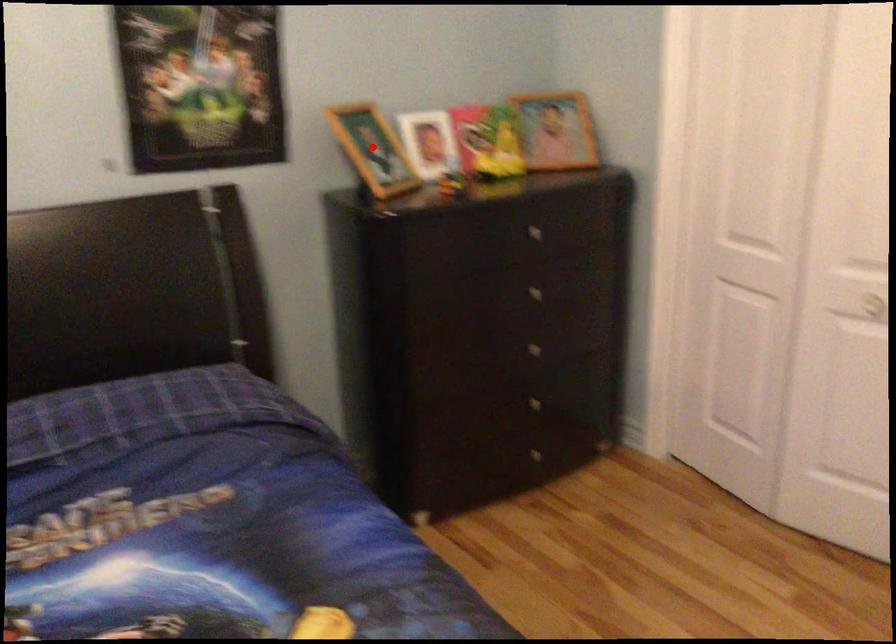
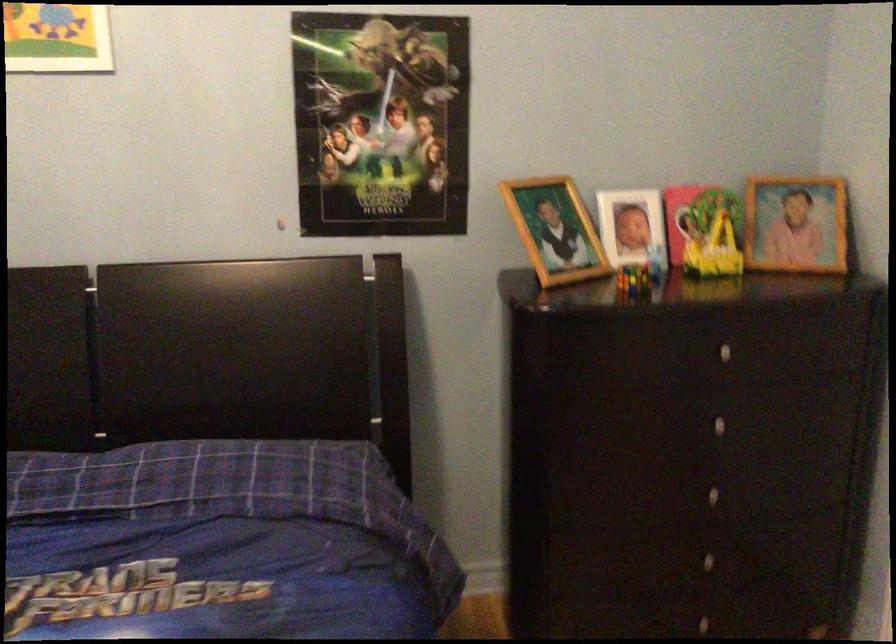
Find the pixel in the second image that matches the highlighted location in the first image.

(555, 230)